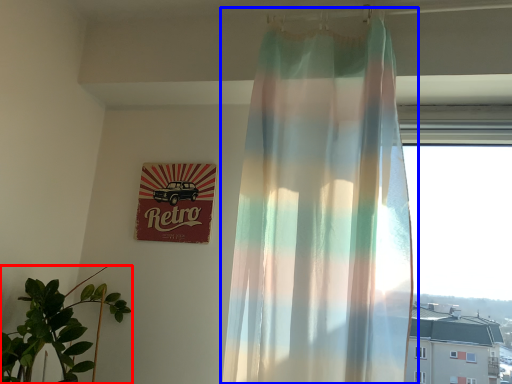
Question: Among these objects, which one is farthest to the camera, houseplant (highlighted by a red box) or curtain (highlighted by a blue box)?

Choices:
 (A) houseplant
 (B) curtain

Answer: (A)